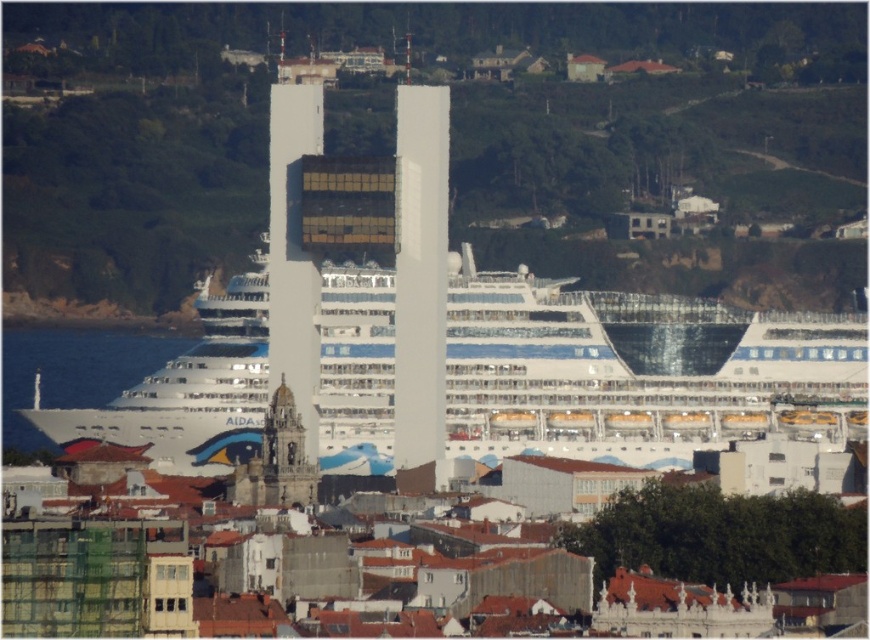
You are standing on the dock and see the white glossy cruise ship at center and the white glass tower at center. Which one is positioned to the right side from your perspective?

The white glossy cruise ship at center is positioned to the right of the white glass tower at center from your perspective.